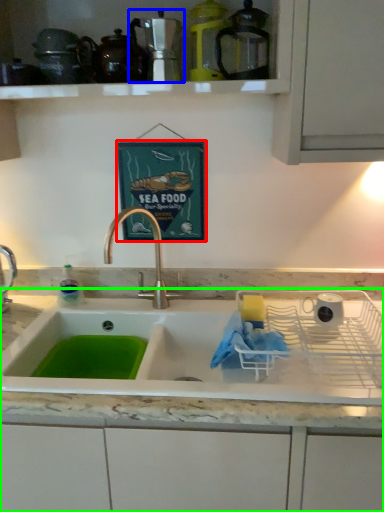
Question: Which is farther away from picture frame (highlighted by a red box)? appliance (highlighted by a blue box) or countertop (highlighted by a green box)?

Choices:
 (A) appliance
 (B) countertop

Answer: (B)